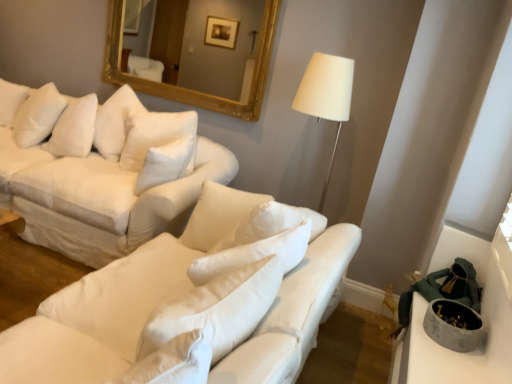
What is the approximate width of white fabric couch at upper left, which is the second studio couch in front-to-back order?

white fabric couch at upper left, which is the second studio couch in front-to-back order, is 1.12 meters in width.

Identify the location of white soft pillow at upper left. (38, 115).

At what (x,y) coordinates should I click in order to perform the action: click on gold-framed mirror at upper center. Please return your answer as a coordinate pair (x, y). The width and height of the screenshot is (512, 384). Looking at the image, I should click on (179, 57).

This screenshot has height=384, width=512. Find the location of `white fabric couch at center, which ranks as the first studio couch in front-to-back order`. white fabric couch at center, which ranks as the first studio couch in front-to-back order is located at coordinates (105, 311).

Which of these two, concrete bowl at lower right or white fabric couch at center, which ranks as the first studio couch in front-to-back order, is wider?

white fabric couch at center, which ranks as the first studio couch in front-to-back order, is wider.

Is concrete bowl at lower right turned away from white fabric couch at center, marked as the 2th studio couch in a back-to-front arrangement?

No, white fabric couch at center, marked as the 2th studio couch in a back-to-front arrangement, is not at the back of concrete bowl at lower right.

Considering the sizes of objects concrete bowl at lower right and white fabric couch at center, which ranks as the first studio couch in front-to-back order, in the image provided, who is bigger, concrete bowl at lower right or white fabric couch at center, which ranks as the first studio couch in front-to-back order,?

white fabric couch at center, which ranks as the first studio couch in front-to-back order.

Consider the image. Is white fabric couch at upper left, acting as the 1th studio couch starting from the back, aimed at white fabric couch at center, marked as the 2th studio couch in a back-to-front arrangement?

No, white fabric couch at upper left, acting as the 1th studio couch starting from the back, is not turned towards white fabric couch at center, marked as the 2th studio couch in a back-to-front arrangement.

How far apart are white fabric couch at upper left, which is the second studio couch in front-to-back order, and white fabric couch at center, marked as the 2th studio couch in a back-to-front arrangement?

A distance of 36.47 inches exists between white fabric couch at upper left, which is the second studio couch in front-to-back order, and white fabric couch at center, marked as the 2th studio couch in a back-to-front arrangement.

Is white fabric couch at upper left, acting as the 1th studio couch starting from the back, wider than white fabric couch at center, which ranks as the first studio couch in front-to-back order?

Yes.

Based on the photo, is white fabric couch at upper left, which is the second studio couch in front-to-back order, taller or shorter than white fabric couch at center, marked as the 2th studio couch in a back-to-front arrangement?

Considering their sizes, white fabric couch at upper left, which is the second studio couch in front-to-back order, has more height than white fabric couch at center, marked as the 2th studio couch in a back-to-front arrangement.

Who is taller, gold-framed mirror at upper center or white soft pillow at upper left?

gold-framed mirror at upper center is taller.

From a real-world perspective, is gold-framed mirror at upper center on top of white soft pillow at upper left?

Indeed, from a real-world perspective, gold-framed mirror at upper center stands above white soft pillow at upper left.

Is white soft pillow at upper left a part of gold-framed mirror at upper center?

No, white soft pillow at upper left is not inside gold-framed mirror at upper center.

Between gold-framed mirror at upper center and white soft pillow at upper left, which one is positioned behind?

Positioned behind is white soft pillow at upper left.

From their relative heights in the image, would you say white soft pillow at upper left is taller or shorter than white fabric couch at upper left, which is the second studio couch in front-to-back order?

In the image, white soft pillow at upper left appears to be shorter than white fabric couch at upper left, which is the second studio couch in front-to-back order.

How many degrees apart are the facing directions of white soft pillow at upper left and white fabric couch at upper left, which is the second studio couch in front-to-back order?

39.9 degrees separate the facing orientations of white soft pillow at upper left and white fabric couch at upper left, which is the second studio couch in front-to-back order.

From the image's perspective, does white soft pillow at upper left appear lower than white fabric couch at upper left, which is the second studio couch in front-to-back order?

Actually, white soft pillow at upper left appears above white fabric couch at upper left, which is the second studio couch in front-to-back order, in the image.

Choose the correct answer: Is white soft pillow at upper left inside white fabric couch at upper left, which is the second studio couch in front-to-back order, or outside it?

white soft pillow at upper left can be found inside white fabric couch at upper left, which is the second studio couch in front-to-back order.

From the image's perspective, is white soft pillow at upper left above or below white fabric couch at center, which ranks as the first studio couch in front-to-back order?

Clearly, from the image's perspective, white soft pillow at upper left is above white fabric couch at center, which ranks as the first studio couch in front-to-back order.

How many degrees apart are the facing directions of white soft pillow at upper left and white fabric couch at center, which ranks as the first studio couch in front-to-back order?

51.3 degrees separate the facing orientations of white soft pillow at upper left and white fabric couch at center, which ranks as the first studio couch in front-to-back order.

Where is `studio couch that is the 2nd object directly below the white soft pillow at upper left (from a real-world perspective)`? The image size is (512, 384). studio couch that is the 2nd object directly below the white soft pillow at upper left (from a real-world perspective) is located at coordinates (105, 311).

Is white soft pillow at upper left at the right side of white fabric couch at center, which ranks as the first studio couch in front-to-back order?

In fact, white soft pillow at upper left is to the left of white fabric couch at center, which ranks as the first studio couch in front-to-back order.

Is white soft pillow at upper left aimed at gold-framed mirror at upper center?

No.

In the scene shown: Based on their positions, is white soft pillow at upper left located to the left or right of gold-framed mirror at upper center?

white soft pillow at upper left is positioned on gold-framed mirror at upper center's left side.

Does white soft pillow at upper left contain gold-framed mirror at upper center?

No, white soft pillow at upper left does not contain gold-framed mirror at upper center.

Looking at this image, what's the angular difference between white soft pillow at upper left and gold-framed mirror at upper center's facing directions?

The angle between the facing direction of white soft pillow at upper left and the facing direction of gold-framed mirror at upper center is 38.7 degrees.

Is concrete bowl at lower right inside or outside of white soft pillow at upper left?

concrete bowl at lower right is located beyond the bounds of white soft pillow at upper left.

Is concrete bowl at lower right further to camera compared to white soft pillow at upper left?

No.

Could you tell me if concrete bowl at lower right is turned towards white soft pillow at upper left?

Yes, concrete bowl at lower right faces towards white soft pillow at upper left.

Is concrete bowl at lower right thinner than white soft pillow at upper left?

Yes.

From the concrete bowl at lower right, count the 1st studio couch to the left and point to it. Please provide its 2D coordinates.

[(105, 311)]

Where is `studio couch behind the white fabric couch at center, marked as the 2th studio couch in a back-to-front arrangement`? This screenshot has width=512, height=384. studio couch behind the white fabric couch at center, marked as the 2th studio couch in a back-to-front arrangement is located at coordinates (105, 172).

From the image, which object appears to be farther from white soft pillow at upper left, gold-framed mirror at upper center or white fabric couch at center, which ranks as the first studio couch in front-to-back order?

The object further to white soft pillow at upper left is white fabric couch at center, which ranks as the first studio couch in front-to-back order.

Based on the photo, looking at the image, which one is located further to white fabric couch at center, which ranks as the first studio couch in front-to-back order, white soft pillow at upper left or gold-framed mirror at upper center?

white soft pillow at upper left is positioned further to the anchor white fabric couch at center, which ranks as the first studio couch in front-to-back order.

From the image, which object appears to be farther from concrete bowl at lower right, white fabric couch at center, which ranks as the first studio couch in front-to-back order, or white soft pillow at upper left?

Among the two, white soft pillow at upper left is located further to concrete bowl at lower right.

Based on their spatial positions, is white soft pillow at upper left or gold-framed mirror at upper center closer to white fabric couch at upper left, acting as the 1th studio couch starting from the back?

The object closer to white fabric couch at upper left, acting as the 1th studio couch starting from the back, is white soft pillow at upper left.

In the scene shown: When comparing their distances from white soft pillow at upper left, does concrete bowl at lower right or white fabric couch at upper left, which is the second studio couch in front-to-back order, seem further?

Among the two, concrete bowl at lower right is located further to white soft pillow at upper left.

From the image, which object appears to be nearer to white fabric couch at upper left, acting as the 1th studio couch starting from the back, white fabric couch at center, marked as the 2th studio couch in a back-to-front arrangement, or white soft pillow at upper left?

white soft pillow at upper left.

Based on their spatial positions, is white soft pillow at upper left or white fabric couch at center, marked as the 2th studio couch in a back-to-front arrangement, closer to gold-framed mirror at upper center?

Among the two, white soft pillow at upper left is located nearer to gold-framed mirror at upper center.

From the image, which object appears to be farther from concrete bowl at lower right, gold-framed mirror at upper center or white fabric couch at center, which ranks as the first studio couch in front-to-back order?

Among the two, gold-framed mirror at upper center is located further to concrete bowl at lower right.

The image size is (512, 384). I want to click on table located between white fabric couch at center, marked as the 2th studio couch in a back-to-front arrangement, and gold-framed mirror at upper center in the depth direction, so click(x=481, y=316).

In order to click on studio couch between white fabric couch at center, marked as the 2th studio couch in a back-to-front arrangement, and white soft pillow at upper left, along the z-axis in this screenshot , I will do `click(105, 172)`.

Identify the location of mirror located between white fabric couch at center, marked as the 2th studio couch in a back-to-front arrangement, and white soft pillow at upper left in the depth direction. click(x=179, y=57).

I want to click on mirror between white soft pillow at upper left and concrete bowl at lower right, so click(x=179, y=57).